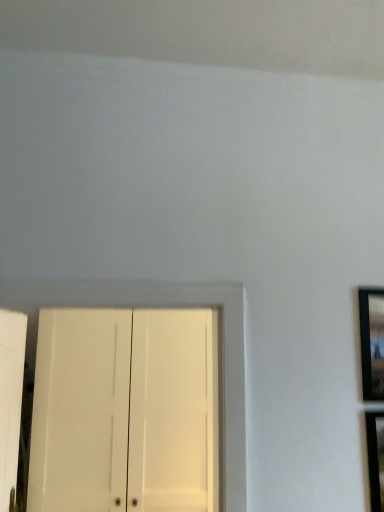
Question: Do you think black glossy picture frame at right is within white matte cabinet at lower left, or outside of it?

Choices:
 (A) outside
 (B) inside

Answer: (A)

Question: Based on their sizes in the image, would you say black glossy picture frame at right is bigger or smaller than white matte cabinet at lower left?

Choices:
 (A) small
 (B) big

Answer: (A)

Question: From the image's perspective, is black glossy picture frame at right positioned above or below white matte cabinet at lower left?

Choices:
 (A) below
 (B) above

Answer: (B)

Question: From their relative heights in the image, would you say white matte cabinet at lower left is taller or shorter than black glossy picture frame at right?

Choices:
 (A) short
 (B) tall

Answer: (B)

Question: Does point (124, 422) appear closer or farther from the camera than point (362, 313)?

Choices:
 (A) farther
 (B) closer

Answer: (A)

Question: Is white matte cabinet at lower left situated inside black glossy picture frame at right or outside?

Choices:
 (A) outside
 (B) inside

Answer: (A)

Question: Considering the relative positions of white matte cabinet at lower left and black glossy picture frame at right in the image provided, is white matte cabinet at lower left to the left or to the right of black glossy picture frame at right?

Choices:
 (A) left
 (B) right

Answer: (A)